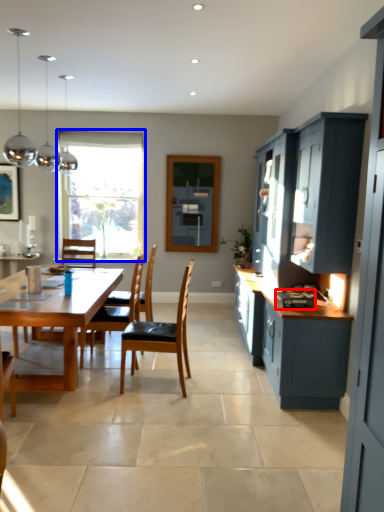
Question: Which point is closer to the camera, appliance (highlighted by a red box) or window (highlighted by a blue box)?

Choices:
 (A) appliance
 (B) window

Answer: (A)